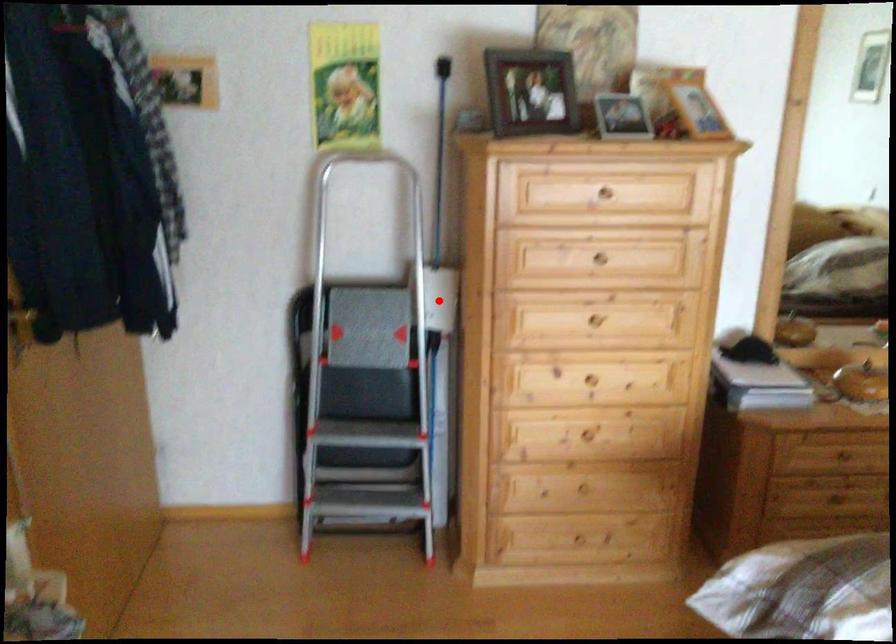
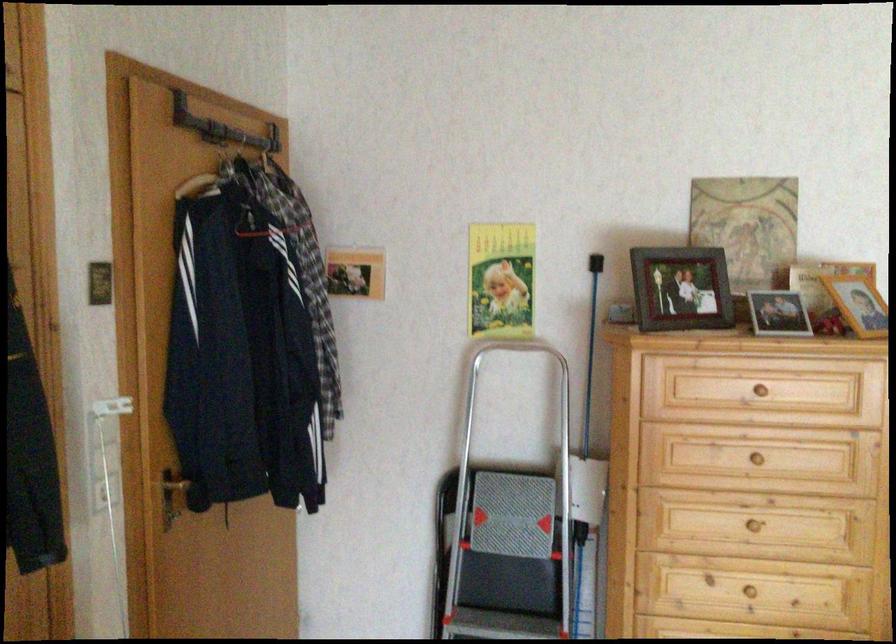
Question: I am providing you with two images of the same scene from different viewpoints. A red point is marked on the first image. At the location where the point appears in image 1, is it still visible in image 2?

Choices:
 (A) Yes
 (B) No

Answer: (A)